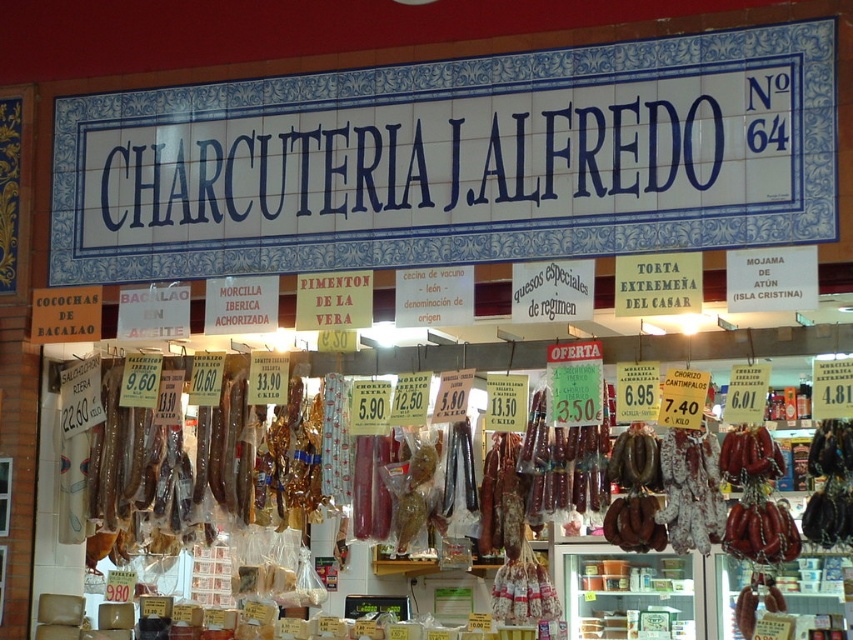
Question: Where is brown leather sausages at center located in relation to brown leather belt at center in the image?

Choices:
 (A) below
 (B) above

Answer: (B)

Question: Estimate the real-world distances between objects in this image. Which object is farther from the brown leather belt at center?

Choices:
 (A) shiny brown sausage at center
 (B) brown leather sausages at center

Answer: (B)

Question: Among these points, which one is farthest from the camera?

Choices:
 (A) (782, 557)
 (B) (112, 524)
 (C) (630, 547)

Answer: (B)

Question: Based on their relative distances, which object is nearer to the brown leather belt at center?

Choices:
 (A) shiny brown sausage at center
 (B) brown leather sausages at center

Answer: (A)

Question: Does shiny brown sausage at center have a larger size compared to brown leather belt at center?

Choices:
 (A) yes
 (B) no

Answer: (B)

Question: Is shiny brown sausage at center closer to the viewer compared to brown leather belt at center?

Choices:
 (A) yes
 (B) no

Answer: (A)